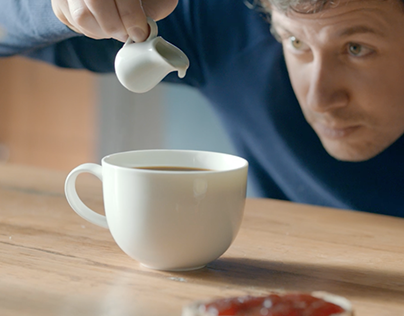
The height and width of the screenshot is (316, 404). Identify the location of tiny white pitcher. (142, 68).